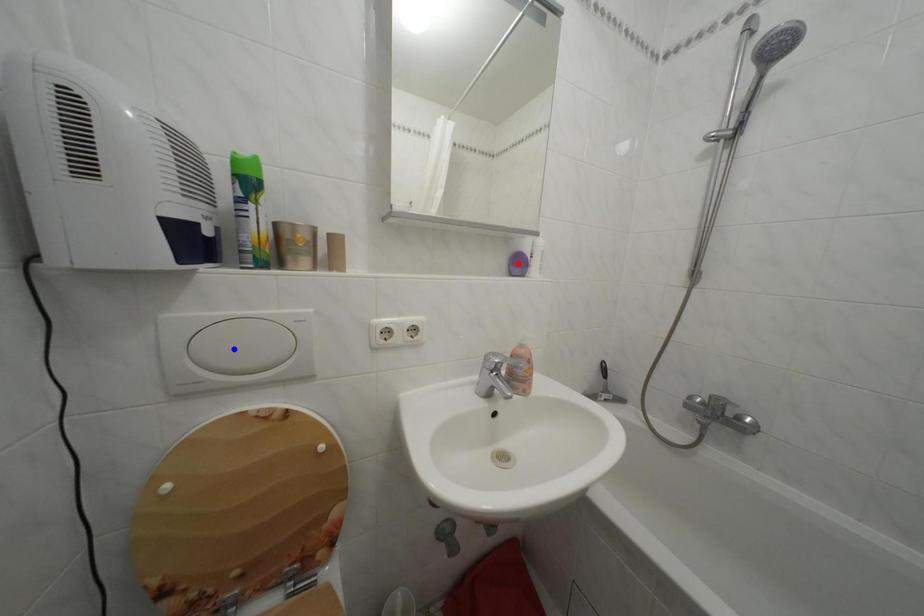
Question: In the image, two points are highlighted. Which point is nearer to the camera? Reply with the corresponding letter.

Choices:
 (A) blue point
 (B) red point

Answer: (A)